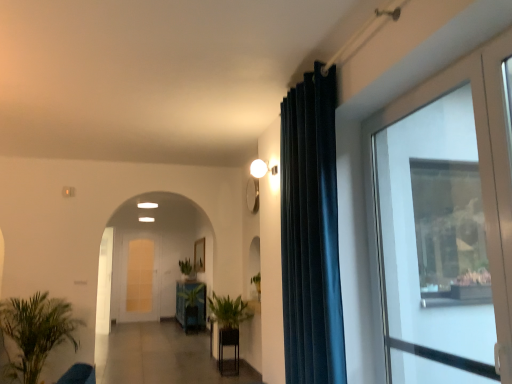
This screenshot has width=512, height=384. What do you see at coordinates (229, 311) in the screenshot?
I see `green leafy plant at center, arranged as the second houseplant when viewed from the right` at bounding box center [229, 311].

Looking at this image, in order to face wooden frame at center, should I rotate leftwards or rightwards?

To align with it, rotate left about 7.565°.

Describe the element at coordinates (35, 332) in the screenshot. I see `green leafy plant at lower left, marked as the third houseplant in a right-to-left arrangement` at that location.

At what (x,y) coordinates should I click in order to perform the action: click on white glass screen door at center, which is the 1th screen door from back to front. Please return your answer as a coordinate pair (x, y). The width and height of the screenshot is (512, 384). Looking at the image, I should click on (138, 277).

The height and width of the screenshot is (384, 512). Describe the element at coordinates (138, 277) in the screenshot. I see `white glass screen door at center, which is the 1th screen door from back to front` at that location.

Image resolution: width=512 pixels, height=384 pixels. What are the coordinates of `green leafy plant at center, arranged as the second houseplant when viewed from the right` in the screenshot? It's located at (229, 311).

Is green leafy plant at center oriented towards transparent glass door at right?

No, green leafy plant at center is not turned towards transparent glass door at right.

Can you tell me how much green leafy plant at center and transparent glass door at right differ in facing direction?

1.37 degrees separate the facing orientations of green leafy plant at center and transparent glass door at right.

Which of these two, green leafy plant at center or transparent glass door at right, stands taller?

transparent glass door at right.

Identify the location of window located above the green leafy plant at center (from the image's perspective). (442, 226).

Can you tell me how much green matte plant at center, which is the third houseplant in left-to-right order, and wooden frame at center differ in facing direction?

0.985 degrees.

Does green matte plant at center, which is the third houseplant in left-to-right order, come in front of wooden frame at center?

Yes, the depth of green matte plant at center, which is the third houseplant in left-to-right order, is less than that of wooden frame at center.

Where is `picture frame that is below the green matte plant at center, the first houseplant in the right-to-left sequence (from the image's perspective)`? The height and width of the screenshot is (384, 512). picture frame that is below the green matte plant at center, the first houseplant in the right-to-left sequence (from the image's perspective) is located at coordinates (199, 255).

From a real-world perspective, is green matte plant at center, which is the third houseplant in left-to-right order, positioned under wooden frame at center based on gravity?

Yes, from a real-world perspective, green matte plant at center, which is the third houseplant in left-to-right order, is under wooden frame at center.

Consider the image. Is green leafy plant at center, acting as the second houseplant starting from the left, surrounded by dark blue velvet curtain at center?

That's incorrect, green leafy plant at center, acting as the second houseplant starting from the left, is not inside dark blue velvet curtain at center.

From the image's perspective, which is above, dark blue velvet curtain at center or green leafy plant at center, arranged as the second houseplant when viewed from the right?

dark blue velvet curtain at center.

Which is in front, dark blue velvet curtain at center or green leafy plant at center, acting as the second houseplant starting from the left?

dark blue velvet curtain at center is in front.

Is dark blue velvet curtain at center far from transparent glass door at right?

No.

From a real-world perspective, is dark blue velvet curtain at center positioned under transparent glass door at right based on gravity?

No, from a real-world perspective, dark blue velvet curtain at center is not below transparent glass door at right.

Is dark blue velvet curtain at center bigger than transparent glass door at right?

Indeed, dark blue velvet curtain at center has a larger size compared to transparent glass door at right.

Does dark blue velvet curtain at center appear on the right side of transparent glass door at right?

In fact, dark blue velvet curtain at center is to the left of transparent glass door at right.

What are the coordinates of `houseplant on the left of the green leafy plant at center` in the screenshot? It's located at (35, 332).

From the image's perspective, is green leafy plant at lower left, the first houseplant positioned from the left, under green leafy plant at center?

Incorrect, from the image's perspective, green leafy plant at lower left, the first houseplant positioned from the left, is higher than green leafy plant at center.

Can you confirm if green leafy plant at lower left, marked as the third houseplant in a right-to-left arrangement, is taller than green leafy plant at center?

Yes.

From a real-world perspective, relative to green leafy plant at center, is green leafy plant at lower left, marked as the third houseplant in a right-to-left arrangement, vertically above or below?

green leafy plant at lower left, marked as the third houseplant in a right-to-left arrangement, is below green leafy plant at center.

In the scene shown: From a real-world perspective, does white glass screen door at center, which is the 2th screen door in front-to-back order, stand above green leafy plant at center, acting as the second houseplant starting from the left?

Yes.

Is white glass screen door at center, which is the 2th screen door in front-to-back order, in contact with green leafy plant at center, arranged as the second houseplant when viewed from the right?

white glass screen door at center, which is the 2th screen door in front-to-back order, is not next to green leafy plant at center, arranged as the second houseplant when viewed from the right, and they're not touching.

In the scene shown: Which is more to the left, white glass screen door at center, which is the 2th screen door in front-to-back order, or green leafy plant at center, acting as the second houseplant starting from the left?

white glass screen door at center, which is the 2th screen door in front-to-back order.

Between point (146, 316) and point (211, 300), which one is positioned behind?

Point (146, 316)

Is green glossy plant pot at center, the second furniture in the right-to-left sequence, positioned behind transparent glass door at right?

That is True.

Is green glossy plant pot at center, marked as the first furniture in a back-to-front arrangement, touching transparent glass door at right?

Result: green glossy plant pot at center, marked as the first furniture in a back-to-front arrangement, and transparent glass door at right are not in contact.

Could you tell me if green glossy plant pot at center, acting as the 1th furniture starting from the left, is facing transparent glass door at right?

No, green glossy plant pot at center, acting as the 1th furniture starting from the left, is not turned towards transparent glass door at right.

Is transparent glass door at right inside green glossy plant pot at center, the second furniture from the front?

Definitely not — transparent glass door at right is not inside green glossy plant pot at center, the second furniture from the front.

At what (x,y) coordinates should I click in order to perform the action: click on window above the green leafy plant at center (from the image's perspective). Please return your answer as a coordinate pair (x, y). Looking at the image, I should click on (442, 226).

This screenshot has width=512, height=384. Identify the location of picture frame to the left of green matte plant at center, the first houseplant in the right-to-left sequence. (199, 255).

From the image, which object appears to be nearer to green leafy plant at lower left, marked as the third houseplant in a right-to-left arrangement, green leafy plant at center or green leafy plant at center, arranged as the second houseplant when viewed from the right?

green leafy plant at center, arranged as the second houseplant when viewed from the right, lies closer to green leafy plant at lower left, marked as the third houseplant in a right-to-left arrangement, than the other object.

Considering their positions, is matte white globe at upper center positioned further to green leafy plant at lower left, marked as the third houseplant in a right-to-left arrangement, than white glossy door at center, acting as the second screen door starting from the back?

Among the two, matte white globe at upper center is located further to green leafy plant at lower left, marked as the third houseplant in a right-to-left arrangement.

Looking at the image, which one is located closer to wooden frame at center, dark blue velvet curtain at center or green glossy plant pot at center, acting as the 1th furniture starting from the left?

Among the two, green glossy plant pot at center, acting as the 1th furniture starting from the left, is located nearer to wooden frame at center.

From the image, which object appears to be farther from green leafy plant at center, matte white globe at upper center or transparent glass door at right?

Based on the image, transparent glass door at right appears to be further to green leafy plant at center.

From the image, which object appears to be farther from white glossy door at center, which is the first screen door from front to back, dark blue velvet curtain at center or wooden frame at center?

dark blue velvet curtain at center.

From the picture: Estimate the real-world distances between objects in this image. Which object is closer to wooden table at center, placed as the first furniture when sorted from front to back, green leafy plant at center, arranged as the second houseplant when viewed from the right, or matte white globe at upper center?

The object closer to wooden table at center, placed as the first furniture when sorted from front to back, is green leafy plant at center, arranged as the second houseplant when viewed from the right.

From the image, which object appears to be nearer to green leafy plant at center, arranged as the second houseplant when viewed from the right, transparent glass door at right or wooden frame at center?

wooden frame at center.

Based on their spatial positions, is white glossy door at center, which is the first screen door from front to back, or green glossy plant pot at center, the second furniture from the front, closer to green matte plant at center, the first houseplant in the right-to-left sequence?

Among the two, white glossy door at center, which is the first screen door from front to back, is located nearer to green matte plant at center, the first houseplant in the right-to-left sequence.

The width and height of the screenshot is (512, 384). In order to click on curtain located between transparent glass door at right and white glass screen door at center, which is the 2th screen door in front-to-back order, in the depth direction in this screenshot , I will do `click(311, 233)`.

Find the location of `furniture located between white glossy door at center, acting as the second screen door starting from the back, and green leafy plant at center in the left-right direction`. furniture located between white glossy door at center, acting as the second screen door starting from the back, and green leafy plant at center in the left-right direction is located at coordinates (191, 305).

This screenshot has width=512, height=384. Identify the location of plant located between matte white globe at upper center and white glossy door at center, which is the first screen door from front to back, in the depth direction. (191, 294).

Image resolution: width=512 pixels, height=384 pixels. In order to click on furniture between green matte plant at center, which is the third houseplant in left-to-right order, and green leafy plant at center in the front-back direction in this screenshot , I will do `click(234, 351)`.